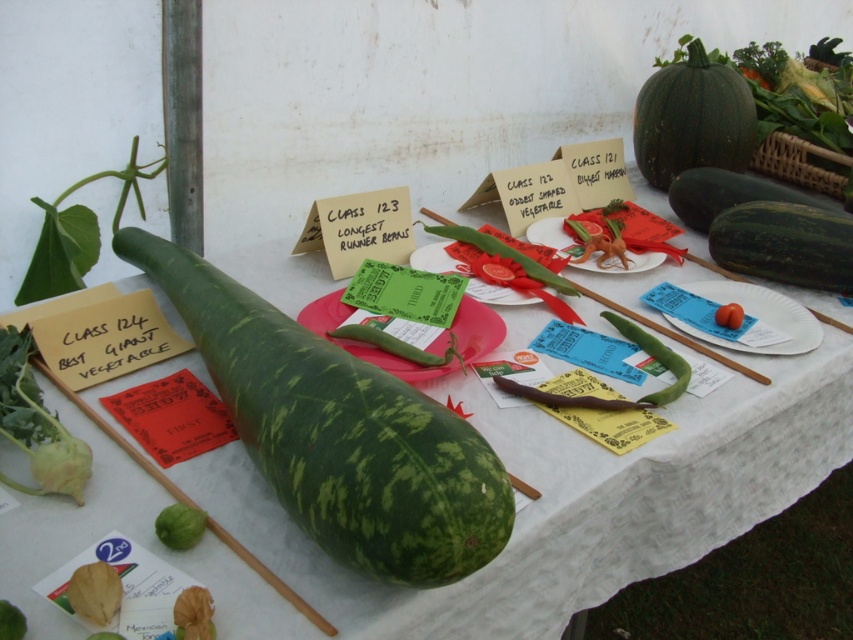
You are a judge at the vegetable competition. You need to determine which vegetable is placed higher on the table. The options are the green spotted squash at left and the green matte squash at center. Which one is higher?

The green spotted squash at left is positioned over the green matte squash at center, so it is higher.

You are a judge at the vegetable competition and need to determine which vegetable is taller. You see the green spotted squash at left and the green matte squash at center. Which one is taller?

The green spotted squash at left is much taller than the green matte squash at center.